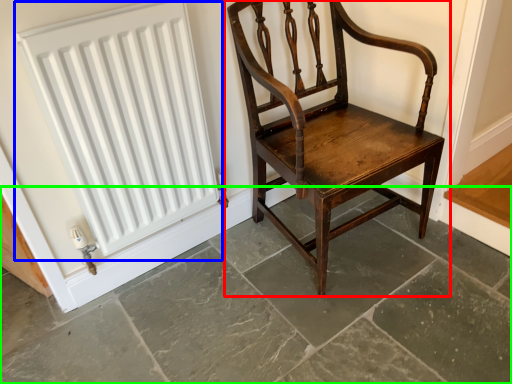
Question: Which object is positioned closest to chair (highlighted by a red box)? Select from radiator (highlighted by a blue box) and concrete (highlighted by a green box).

Choices:
 (A) radiator
 (B) concrete

Answer: (B)